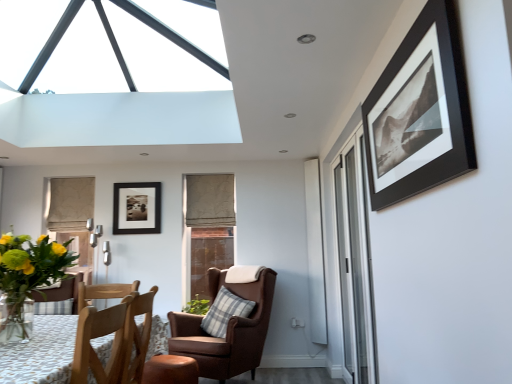
Question: From their relative heights in the image, would you say transparent glass window at upper center, positioned as the first window in left-to-right order, is taller or shorter than black matte picture frame at upper right, which is counted as the first picture frame, starting from the front?

Choices:
 (A) short
 (B) tall

Answer: (A)

Question: Is transparent glass window at upper center, the first window from the top, in front of or behind black matte picture frame at upper right, which is the 2th picture frame in back-to-front order, in the image?

Choices:
 (A) behind
 (B) front

Answer: (A)

Question: Which object is positioned farthest from the green leafy plant at lower left?

Choices:
 (A) leather wingback chair with plaid pillow at center, which is counted as the second chair, starting from the front
 (B) black matte picture frame at upper right, which ranks as the first picture frame in right-to-left order
 (C) beige fabric curtain at center
 (D) clear glass window at center, the 1th window in the back-to-front sequence
 (E) transparent glass window at upper center, the first window from the top

Answer: (C)

Question: Which object is positioned farthest from the clear glass window at center, the 1th window in the back-to-front sequence?

Choices:
 (A) wooden desk at lower left
 (B) black matte picture frame at upper right, which ranks as the first picture frame in right-to-left order
 (C) green leafy plant at lower left
 (D) matte black picture frame at center, positioned as the first picture frame in left-to-right order
 (E) wooden chair at lower left, positioned as the second chair in back-to-front order

Answer: (B)